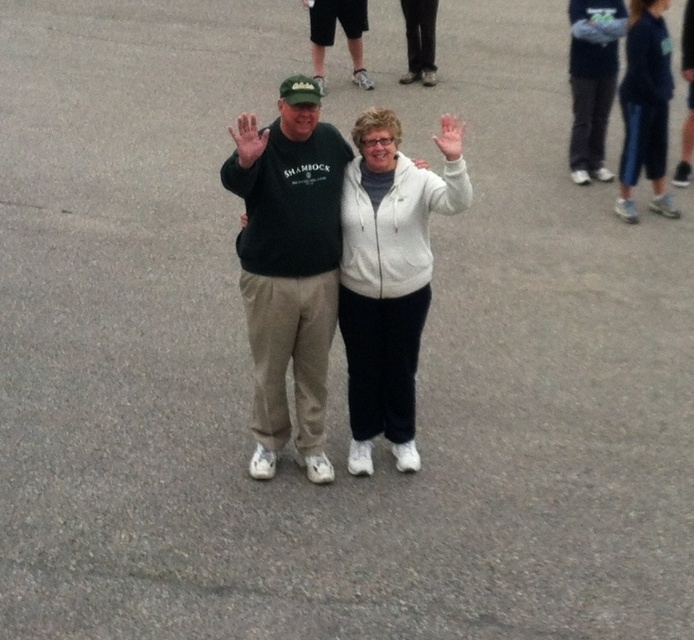
You are standing at the origin point in the image. You need to locate the white fleece jacket at center. Which direction should you move to reach it?

The white fleece jacket at center is located at point 0.434 on the x axis and 0.562 on the y axis. Since you are at the origin, you should move towards the right along the x axis and upwards along the y axis to reach the white fleece jacket at center.

You are a delivery robot with a width of 1.2 meters. You need to pass between the dark green sweatshirt at center and the blue fleece sweatshirt at right. Can you fit through the space between them?

The distance between the dark green sweatshirt at center and the blue fleece sweatshirt at right is 4.86 meters. Since the robot is 1.2 meters wide, it can easily pass through the space between them as the distance is significantly larger than the robot.